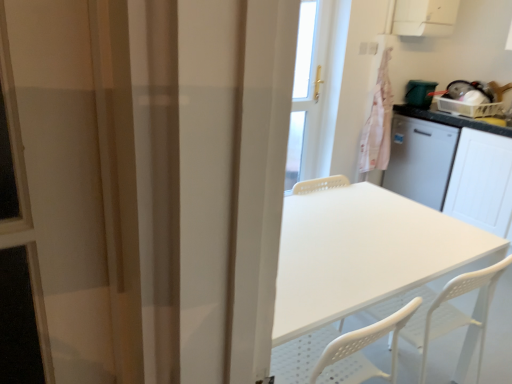
Question: Is white plastic exhaust hood at upper right smaller than white matte cabinet at right?

Choices:
 (A) yes
 (B) no

Answer: (A)

Question: From the image's perspective, is white plastic exhaust hood at upper right above white matte cabinet at right?

Choices:
 (A) yes
 (B) no

Answer: (A)

Question: Would you say white plastic exhaust hood at upper right contains white matte cabinet at right?

Choices:
 (A) yes
 (B) no

Answer: (B)

Question: Is white plastic exhaust hood at upper right shorter than white matte cabinet at right?

Choices:
 (A) yes
 (B) no

Answer: (A)

Question: Is white plastic exhaust hood at upper right not inside white matte cabinet at right?

Choices:
 (A) yes
 (B) no

Answer: (A)

Question: Considering the positions of white matte cabinet at right and white glossy countertop at right in the image, is white matte cabinet at right bigger or smaller than white glossy countertop at right?

Choices:
 (A) small
 (B) big

Answer: (B)

Question: Is point (496, 157) positioned closer to the camera than point (430, 117)?

Choices:
 (A) farther
 (B) closer

Answer: (B)

Question: Is white matte cabinet at right wider or thinner than white glossy countertop at right?

Choices:
 (A) thin
 (B) wide

Answer: (B)

Question: In terms of height, does white matte cabinet at right look taller or shorter compared to white glossy countertop at right?

Choices:
 (A) tall
 (B) short

Answer: (A)

Question: Is point (400, 19) closer or farther from the camera than point (406, 97)?

Choices:
 (A) closer
 (B) farther

Answer: (A)

Question: In the image, is white plastic exhaust hood at upper right positioned in front of or behind green plastic bin at right?

Choices:
 (A) front
 (B) behind

Answer: (A)

Question: Considering the positions of white plastic exhaust hood at upper right and green plastic bin at right in the image, is white plastic exhaust hood at upper right bigger or smaller than green plastic bin at right?

Choices:
 (A) small
 (B) big

Answer: (B)

Question: In terms of height, does white plastic exhaust hood at upper right look taller or shorter compared to green plastic bin at right?

Choices:
 (A) short
 (B) tall

Answer: (B)

Question: Is white plastic table at center to the left or to the right of white glossy countertop at right in the image?

Choices:
 (A) left
 (B) right

Answer: (A)

Question: Is white plastic table at center inside or outside of white glossy countertop at right?

Choices:
 (A) outside
 (B) inside

Answer: (A)